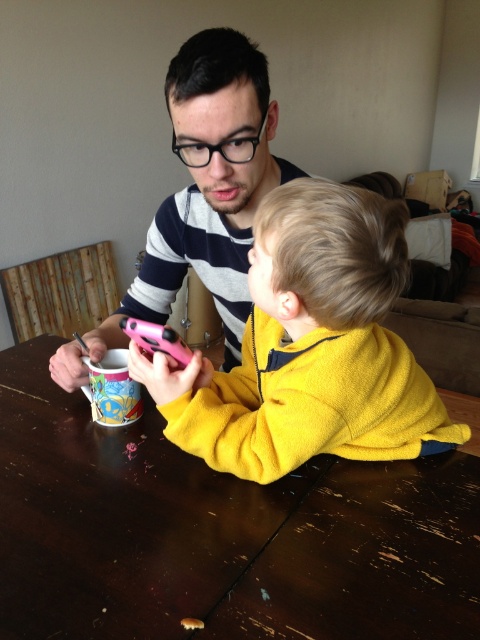
Question: Which point is closer to the camera?

Choices:
 (A) yellow fleece jacket at center
 (B) matte striped sweater at upper center
 (C) pink plastic phone at center
 (D) multicolored plastic cup at lower left

Answer: (A)

Question: Which point is closer to the camera taking this photo?

Choices:
 (A) (330, 588)
 (B) (122, 369)
 (C) (187, 358)
 (D) (215, 120)

Answer: (A)

Question: Does yellow fleece jacket at center have a lesser width compared to matte striped sweater at upper center?

Choices:
 (A) no
 (B) yes

Answer: (A)

Question: Does yellow fleece jacket at center have a lesser width compared to multicolored plastic cup at lower left?

Choices:
 (A) no
 (B) yes

Answer: (A)

Question: Which of these objects is positioned closest to the multicolored plastic cup at lower left?

Choices:
 (A) yellow fleece jacket at center
 (B) pink plastic phone at center
 (C) wooden table at center
 (D) matte striped sweater at upper center

Answer: (B)

Question: Can you confirm if wooden table at center is wider than yellow fleece jacket at center?

Choices:
 (A) yes
 (B) no

Answer: (A)